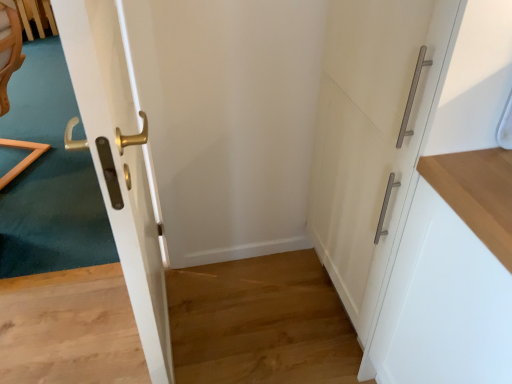
Question: Considering the positions of white matte cabinet at right and white matte cabinet handle at right, which appears as the 1th door when viewed from the right, in the image, is white matte cabinet at right taller or shorter than white matte cabinet handle at right, which appears as the 1th door when viewed from the right,?

Choices:
 (A) tall
 (B) short

Answer: (B)

Question: Is white matte cabinet at right in front of or behind white matte cabinet handle at right, the second door in the left-to-right sequence, in the image?

Choices:
 (A) behind
 (B) front

Answer: (B)

Question: Considering the real-world distances, which object is farthest from the white matte cabinet at right?

Choices:
 (A) glossy white door at left, marked as the first door in a left-to-right arrangement
 (B) white matte cabinet handle at right, which appears as the 1th door when viewed from the right

Answer: (A)

Question: Which object is positioned closest to the white matte cabinet at right?

Choices:
 (A) white matte cabinet handle at right, the second door in the left-to-right sequence
 (B) glossy white door at left, which is the second door from right to left

Answer: (A)